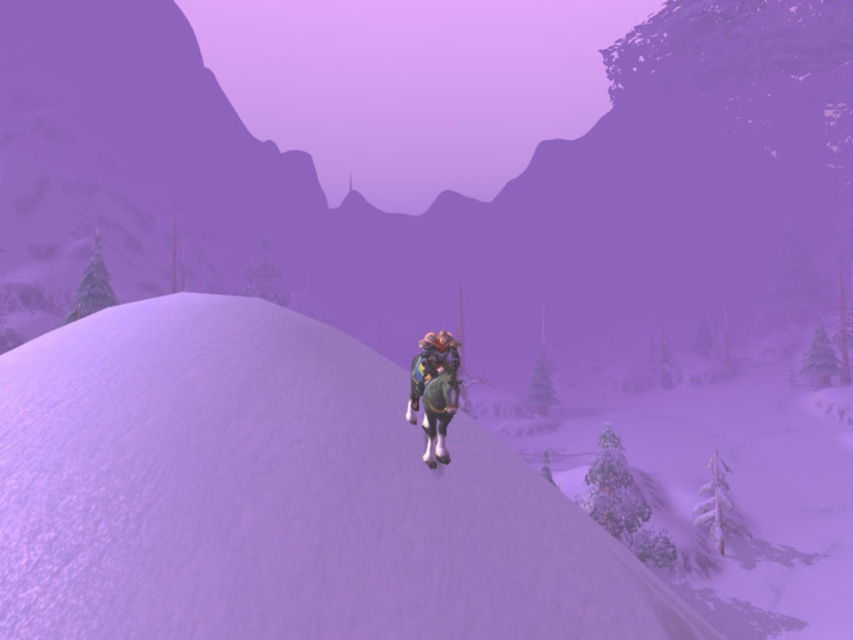
Question: Is white matte snow at center closer to the viewer compared to shiny blue armor at center?

Choices:
 (A) yes
 (B) no

Answer: (B)

Question: Among these points, which one is farthest from the camera?

Choices:
 (A) (422, 339)
 (B) (334, 243)
 (C) (556, 564)

Answer: (B)

Question: Can you confirm if white snow at center is smaller than shiny blue armor at center?

Choices:
 (A) no
 (B) yes

Answer: (A)

Question: Estimate the real-world distances between objects in this image. Which object is closer to the white snow at center?

Choices:
 (A) shiny blue armor at center
 (B) white matte snow at center

Answer: (A)

Question: Does white matte snow at center come in front of shiny blue armor at center?

Choices:
 (A) no
 (B) yes

Answer: (A)

Question: Which point is closer to the camera taking this photo?

Choices:
 (A) (436, 490)
 (B) (451, 339)
 (C) (514, 356)

Answer: (A)